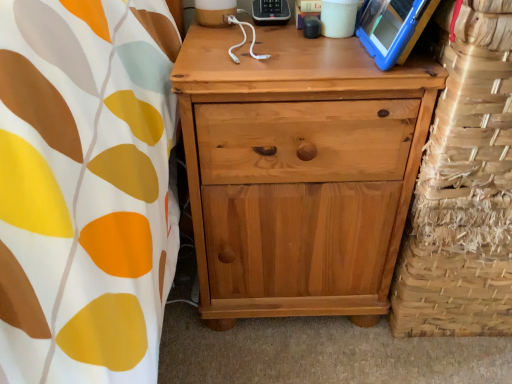
Question: Does woven straw basket at right have a lesser width compared to natural wood chest of drawers at center?

Choices:
 (A) yes
 (B) no

Answer: (A)

Question: Is woven straw basket at right looking in the opposite direction of natural wood chest of drawers at center?

Choices:
 (A) no
 (B) yes

Answer: (A)

Question: Is woven straw basket at right completely or partially outside of natural wood chest of drawers at center?

Choices:
 (A) no
 (B) yes

Answer: (B)

Question: Would you say natural wood chest of drawers at center is part of woven straw basket at right's contents?

Choices:
 (A) yes
 (B) no

Answer: (B)

Question: From a real-world perspective, does woven straw basket at right sit lower than natural wood chest of drawers at center?

Choices:
 (A) yes
 (B) no

Answer: (B)

Question: Is woven straw basket at right bigger than natural wood chest of drawers at center?

Choices:
 (A) no
 (B) yes

Answer: (A)

Question: Is natural wood chest of drawers at center looking in the opposite direction of woven straw basket at right?

Choices:
 (A) no
 (B) yes

Answer: (A)

Question: Does natural wood chest of drawers at center have a smaller size compared to woven straw basket at right?

Choices:
 (A) yes
 (B) no

Answer: (B)

Question: From the image's perspective, is natural wood chest of drawers at center over woven straw basket at right?

Choices:
 (A) yes
 (B) no

Answer: (B)

Question: Is natural wood chest of drawers at center to the right of woven straw basket at right from the viewer's perspective?

Choices:
 (A) no
 (B) yes

Answer: (A)

Question: Is the depth of natural wood chest of drawers at center less than that of woven straw basket at right?

Choices:
 (A) yes
 (B) no

Answer: (B)

Question: Does natural wood chest of drawers at center have a greater width compared to woven straw basket at right?

Choices:
 (A) no
 (B) yes

Answer: (B)

Question: Is natural wood chest of drawers at center bigger or smaller than woven straw basket at right?

Choices:
 (A) big
 (B) small

Answer: (A)